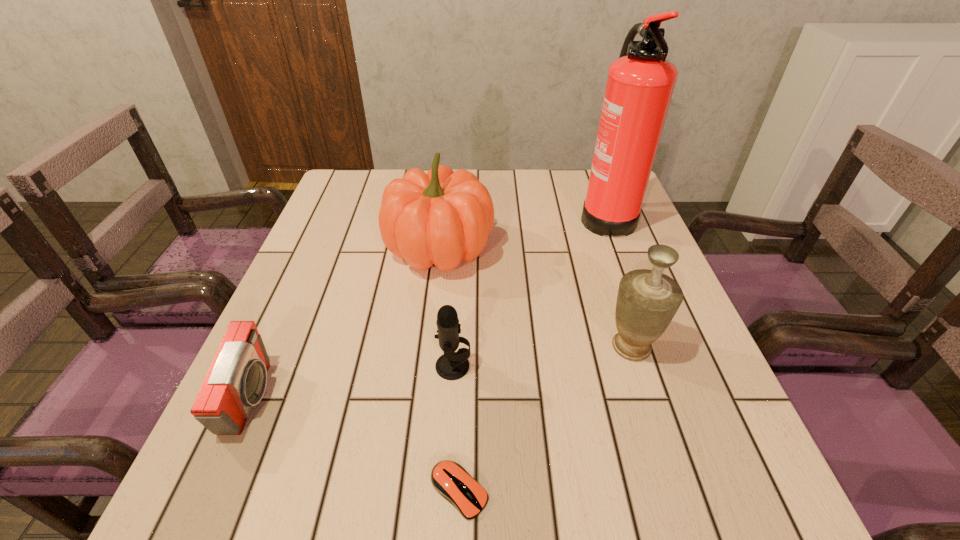
I want to click on vacant position in the image that satisfies the following two spatial constraints: 1. on the front side of the fourth tallest object; 2. on the front-facing side of the second shortest object, so click(451, 398).

The image size is (960, 540). In order to click on free spot that satisfies the following two spatial constraints: 1. on the front-facing side of the nearest object; 2. on the right side of the leftmost object in this screenshot , I will do `click(210, 491)`.